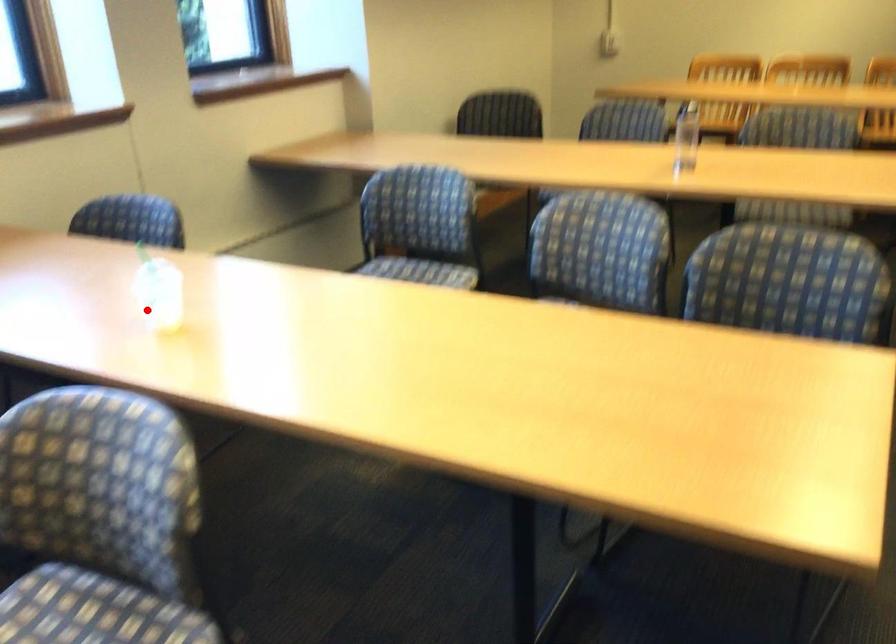
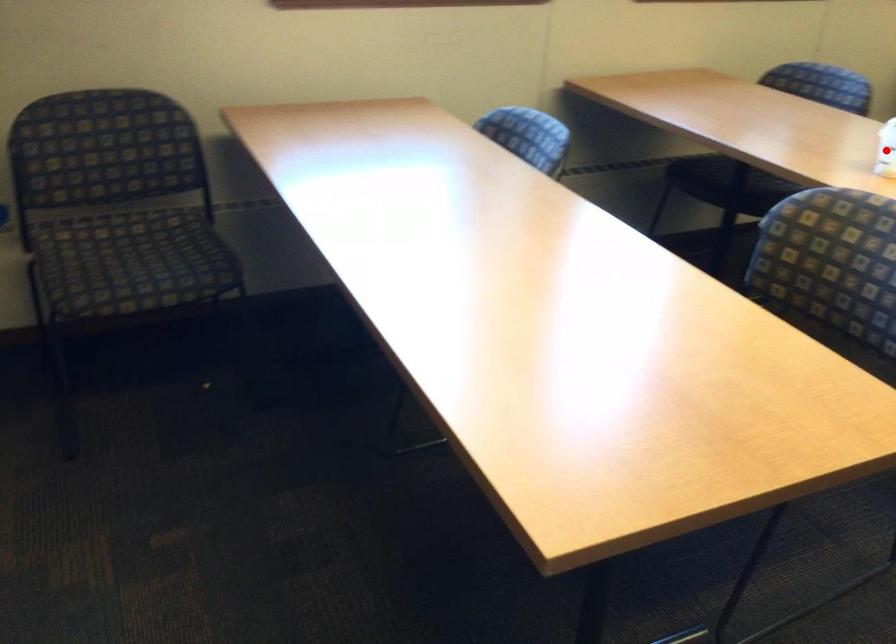
I am providing you with two images of the same scene from different viewpoints. A red point is marked on the first image and another point is marked on the second image. Does the point marked in image1 correspond to the same location as the one in image2?

Yes